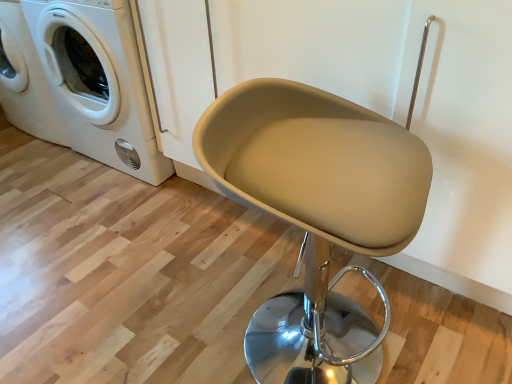
Question: Is white glossy washing machine at upper left inside the boundaries of beige fabric swivel chair at center, or outside?

Choices:
 (A) outside
 (B) inside

Answer: (A)

Question: Is white glossy washing machine at upper left in front of or behind beige fabric swivel chair at center in the image?

Choices:
 (A) front
 (B) behind

Answer: (B)

Question: Based on their sizes in the image, would you say white glossy washing machine at upper left is bigger or smaller than beige fabric swivel chair at center?

Choices:
 (A) small
 (B) big

Answer: (B)

Question: From the image's perspective, is beige fabric swivel chair at center located above or below white glossy washing machine at upper left?

Choices:
 (A) above
 (B) below

Answer: (B)

Question: In terms of height, does beige fabric swivel chair at center look taller or shorter compared to white glossy washing machine at upper left?

Choices:
 (A) tall
 (B) short

Answer: (B)

Question: Is beige fabric swivel chair at center inside or outside of white glossy washing machine at upper left?

Choices:
 (A) inside
 (B) outside

Answer: (B)

Question: Considering the relative positions of beige fabric swivel chair at center and white glossy washing machine at upper left in the image provided, is beige fabric swivel chair at center to the left or to the right of white glossy washing machine at upper left?

Choices:
 (A) left
 (B) right

Answer: (B)